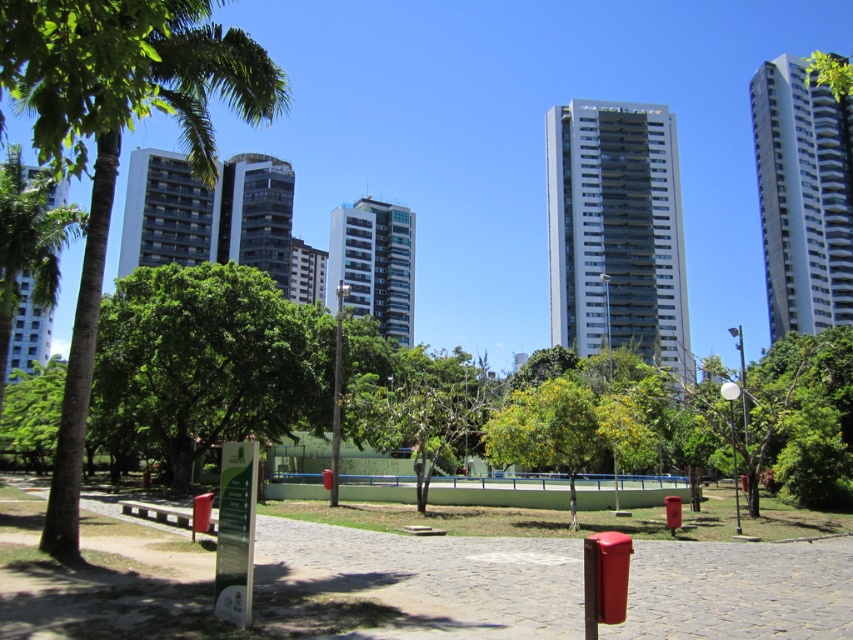
Question: Which point is closer to the camera taking this photo?

Choices:
 (A) (186, 237)
 (B) (373, 296)
 (C) (142, 515)
 (D) (602, 202)

Answer: (C)

Question: Estimate the real-world distances between objects in this image. Which object is closer to the white glossy building at center?

Choices:
 (A) green leafy palm tree at left
 (B) white glass building at left
 (C) glassy reflective building at center
 (D) green leafy tree at center

Answer: (C)

Question: Is green leafy palm tree at left wider than glassy reflective building at center?

Choices:
 (A) yes
 (B) no

Answer: (B)

Question: Can you confirm if white glass building at left is wider than smooth glass building at center?

Choices:
 (A) yes
 (B) no

Answer: (A)

Question: Does white glass building at left have a lesser width compared to smooth glass building at center?

Choices:
 (A) yes
 (B) no

Answer: (B)

Question: Which point is closer to the camera?

Choices:
 (A) (161, 522)
 (B) (15, 342)
 (C) (172, 349)
 (D) (306, 284)

Answer: (A)